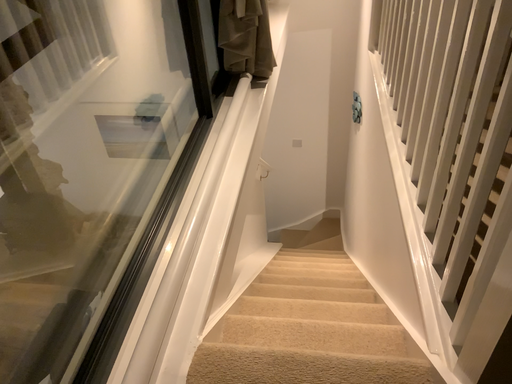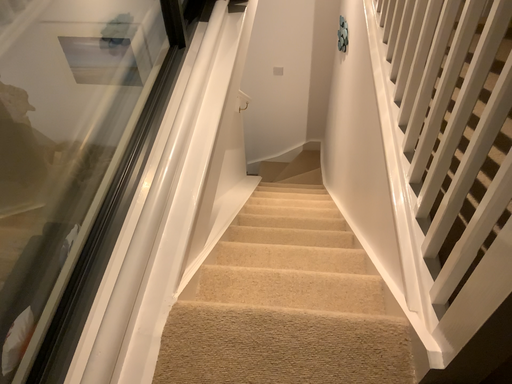
Question: How did the camera likely rotate when shooting the video?

Choices:
 (A) rotated upward
 (B) rotated downward

Answer: (B)